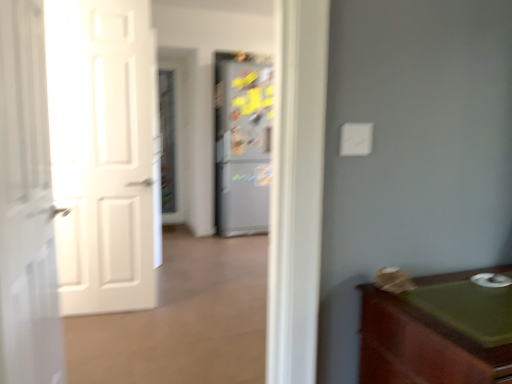
At what (x,y) coordinates should I click in order to perform the action: click on free space in front of white matte door at left, arranged as the 2th door when viewed from the front. Please return your answer as a coordinate pair (x, y). Looking at the image, I should click on (110, 324).